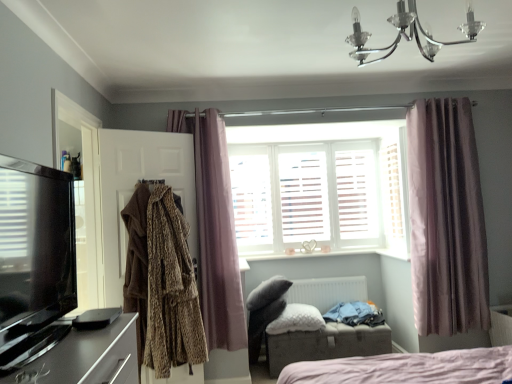
I want to click on empty space that is ontop of white wooden shutters at center (from a real-world perspective), so click(291, 141).